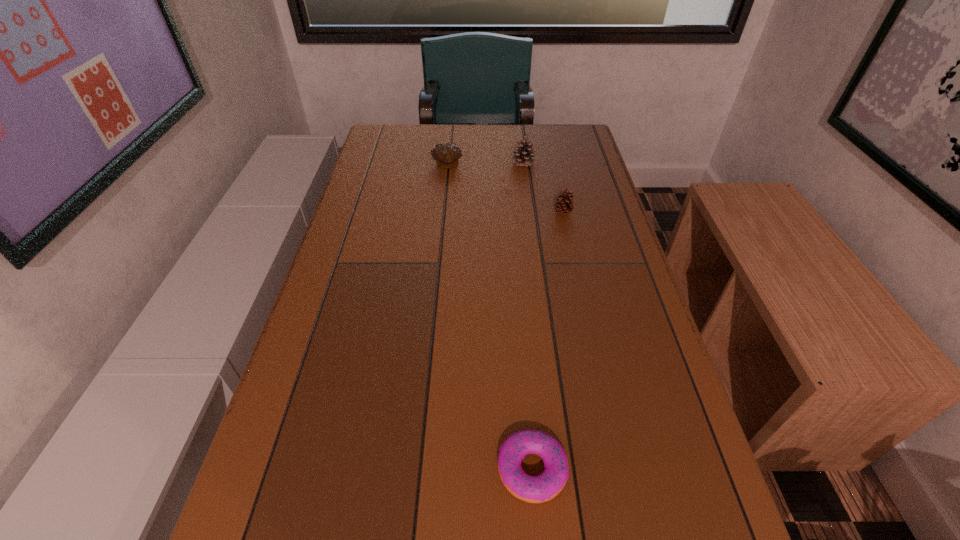
Locate an element on the screen. The height and width of the screenshot is (540, 960). the farther pinecone is located at coordinates [525, 156].

The height and width of the screenshot is (540, 960). What are the coordinates of `the second nearest object` in the screenshot? It's located at (563, 206).

The image size is (960, 540). What are the coordinates of `the nearer pinecone` in the screenshot? It's located at (563, 206).

Identify the location of the second shortest object. click(x=446, y=155).

At what (x,y) coordinates should I click in order to perform the action: click on muffin. Please return your answer as a coordinate pair (x, y). Looking at the image, I should click on (446, 155).

You are a GUI agent. You are given a task and a screenshot of the screen. Output one action in this format:
    pyautogui.click(x=<x>, y=<y>)
    Task: Click on the nearest object
    This screenshot has height=540, width=960.
    Given the screenshot: What is the action you would take?
    pyautogui.click(x=533, y=489)

Where is `the shortest object`? This screenshot has width=960, height=540. the shortest object is located at coordinates (533, 489).

Where is `vacant region located 0.300m on the front of the left pinecone`? Image resolution: width=960 pixels, height=540 pixels. vacant region located 0.300m on the front of the left pinecone is located at coordinates (532, 228).

Where is `vacant space located on the front of the nearer pinecone`? vacant space located on the front of the nearer pinecone is located at coordinates (581, 296).

The width and height of the screenshot is (960, 540). What are the coordinates of `vacant space located 0.110m on the right of the muffin` in the screenshot? It's located at (496, 165).